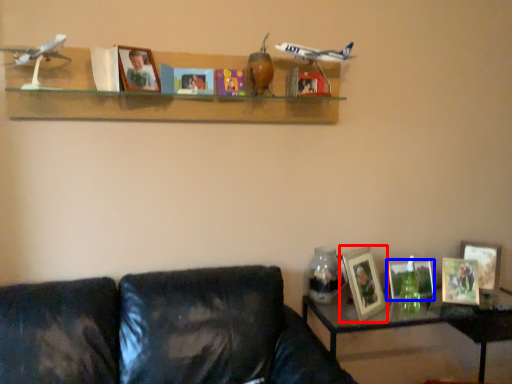
Question: Which point is closer to the camera, picture frame (highlighted by a red box) or picture frame (highlighted by a blue box)?

Choices:
 (A) picture frame
 (B) picture frame

Answer: (A)